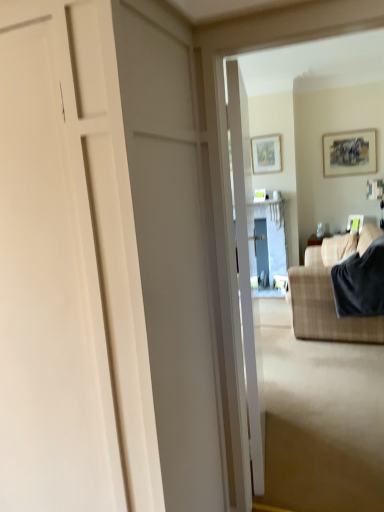
Question: Is white matte door at center, the 2th door from the right, wider than matte white picture frame at upper right, acting as the 3th picture frame starting from the left?

Choices:
 (A) yes
 (B) no

Answer: (A)

Question: Is white matte door at center, the 2th door from the right, located outside matte white picture frame at upper right, the 1th picture frame viewed from the right?

Choices:
 (A) yes
 (B) no

Answer: (A)

Question: From a real-world perspective, is white matte door at center, the 1th door in the left-to-right sequence, positioned over matte white picture frame at upper right, acting as the 3th picture frame starting from the left, based on gravity?

Choices:
 (A) yes
 (B) no

Answer: (A)

Question: Does white matte door at center, the 2th door from the right, have a greater height compared to matte white picture frame at upper right, the 1th picture frame viewed from the right?

Choices:
 (A) no
 (B) yes

Answer: (B)

Question: Considering the relative sizes of white matte door at center, the 2th door from the right, and matte white picture frame at upper right, positioned as the third picture frame in top-to-bottom order, in the image provided, is white matte door at center, the 2th door from the right, shorter than matte white picture frame at upper right, positioned as the third picture frame in top-to-bottom order,?

Choices:
 (A) no
 (B) yes

Answer: (A)

Question: Is point (360, 267) closer or farther from the camera than point (236, 99)?

Choices:
 (A) closer
 (B) farther

Answer: (B)

Question: Which is correct: dark gray fabric at right is inside white glossy door at center, which is the 1th door from right to left, or outside of it?

Choices:
 (A) inside
 (B) outside

Answer: (B)

Question: From a real-world perspective, relative to white glossy door at center, which is the 1th door from right to left, is dark gray fabric at right vertically above or below?

Choices:
 (A) above
 (B) below

Answer: (B)

Question: Considering the positions of dark gray fabric at right and white glossy door at center, which is the 1th door from right to left, in the image, is dark gray fabric at right taller or shorter than white glossy door at center, which is the 1th door from right to left,?

Choices:
 (A) short
 (B) tall

Answer: (A)

Question: Based on their sizes in the image, would you say matte wooden picture frame at upper right, marked as the 2th picture frame in a top-to-bottom arrangement, is bigger or smaller than matte wooden picture frame at upper center, the 1th picture frame in the left-to-right sequence?

Choices:
 (A) big
 (B) small

Answer: (A)

Question: From a real-world perspective, is matte wooden picture frame at upper right, the 2th picture frame when ordered from right to left, above or below matte wooden picture frame at upper center, acting as the 3th picture frame starting from the right?

Choices:
 (A) below
 (B) above

Answer: (A)

Question: Visually, is matte wooden picture frame at upper right, the 2th picture frame when ordered from right to left, positioned to the left or to the right of matte wooden picture frame at upper center, which appears as the 3th picture frame when ordered from the bottom?

Choices:
 (A) left
 (B) right

Answer: (B)

Question: From their relative heights in the image, would you say matte wooden picture frame at upper right, marked as the 2th picture frame in a top-to-bottom arrangement, is taller or shorter than matte wooden picture frame at upper center, acting as the 3th picture frame starting from the right?

Choices:
 (A) short
 (B) tall

Answer: (B)

Question: From the image's perspective, is white matte door at center, the 2th door from the right, located above or below dark gray fabric at right?

Choices:
 (A) above
 (B) below

Answer: (B)

Question: Is white matte door at center, the 2th door from the right, taller or shorter than dark gray fabric at right?

Choices:
 (A) tall
 (B) short

Answer: (A)